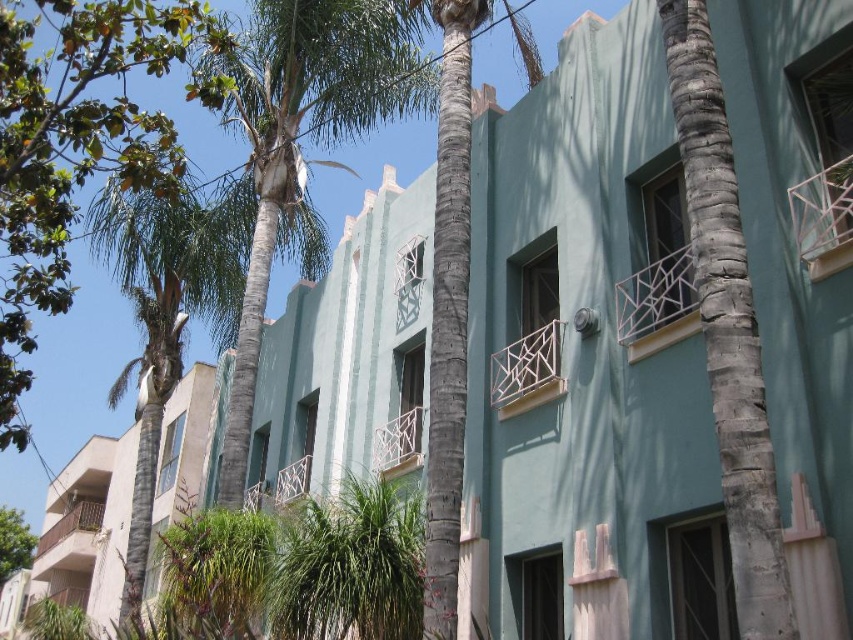
Question: Is green leafy palm tree at upper left in front of beige concrete building at left?

Choices:
 (A) yes
 (B) no

Answer: (A)

Question: Is gray textured palm tree at center thinner than green leafy tree at lower left?

Choices:
 (A) yes
 (B) no

Answer: (A)

Question: Can you confirm if green leafy palm tree at upper left is wider than gray textured palm tree at center?

Choices:
 (A) no
 (B) yes

Answer: (B)

Question: Which point is farther to the camera?

Choices:
 (A) gray textured palm tree at center
 (B) green leafy palm tree at upper left
 (C) beige concrete building at left

Answer: (C)

Question: Which point is farther to the camera?

Choices:
 (A) (711, 339)
 (B) (19, 509)

Answer: (B)

Question: Among these points, which one is nearest to the camera?

Choices:
 (A) (727, 371)
 (B) (96, 561)

Answer: (A)